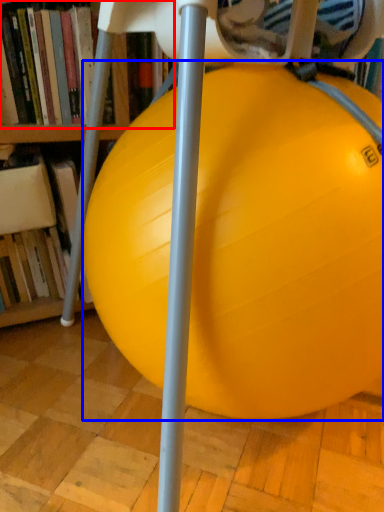
Question: Which object appears farthest to the camera in this image, book (highlighted by a red box) or ball (highlighted by a blue box)?

Choices:
 (A) book
 (B) ball

Answer: (A)